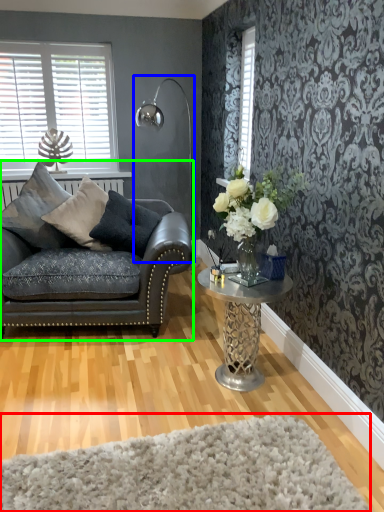
Question: Based on their relative distances, which object is farther from plain (highlighted by a red box)? Choose from lamp (highlighted by a blue box) and studio couch (highlighted by a green box).

Choices:
 (A) lamp
 (B) studio couch

Answer: (A)